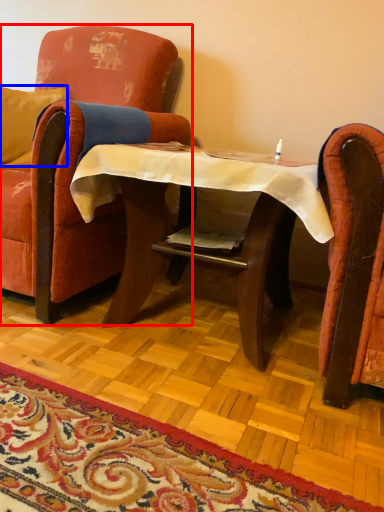
Question: Which object appears closest to the camera in this image, chair (highlighted by a red box) or pillow (highlighted by a blue box)?

Choices:
 (A) chair
 (B) pillow

Answer: (A)